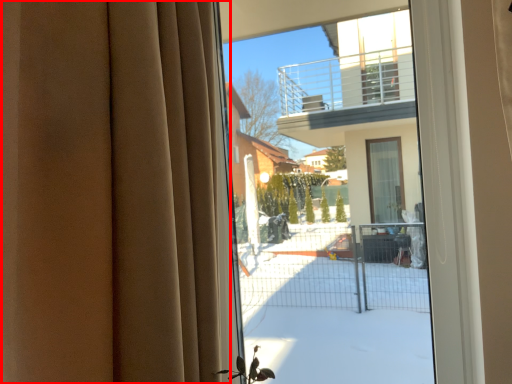
Question: From the image's perspective, what is the correct spatial relationship of curtain (annotated by the red box) in relation to bay window?

Choices:
 (A) below
 (B) above

Answer: (A)